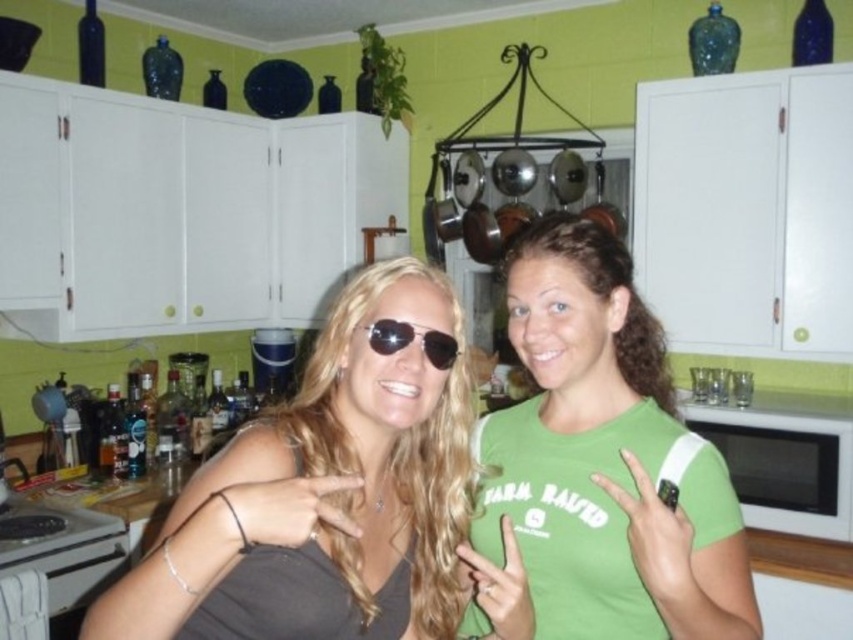
You are a photographer adjusting your camera to focus on the two people in the kitchen. Which clothing item should you focus on first if you want to ensure both the matte gray tank top at center and the green cotton shirt at center are in sharp focus?

The matte gray tank top at center is closer to the viewer than the green cotton shirt at center, so focusing on it first will help ensure both are in sharp focus since it is the nearest object.